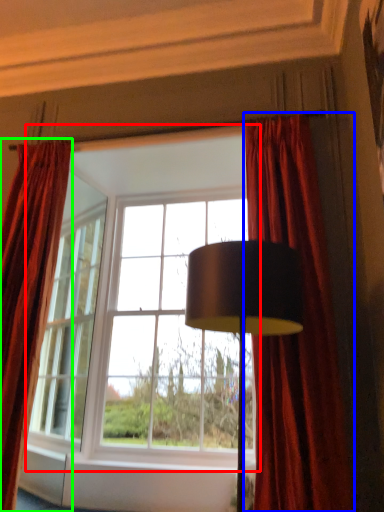
Question: Estimate the real-world distances between objects in this image. Which object is closer to window (highlighted by a red box), curtain (highlighted by a blue box) or curtain (highlighted by a green box)?

Choices:
 (A) curtain
 (B) curtain

Answer: (B)